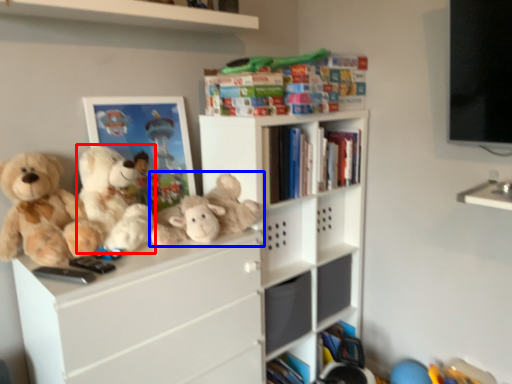
Question: Which of the following is the farthest to the observer, teddy bear (highlighted by a red box) or toy (highlighted by a blue box)?

Choices:
 (A) teddy bear
 (B) toy

Answer: (B)